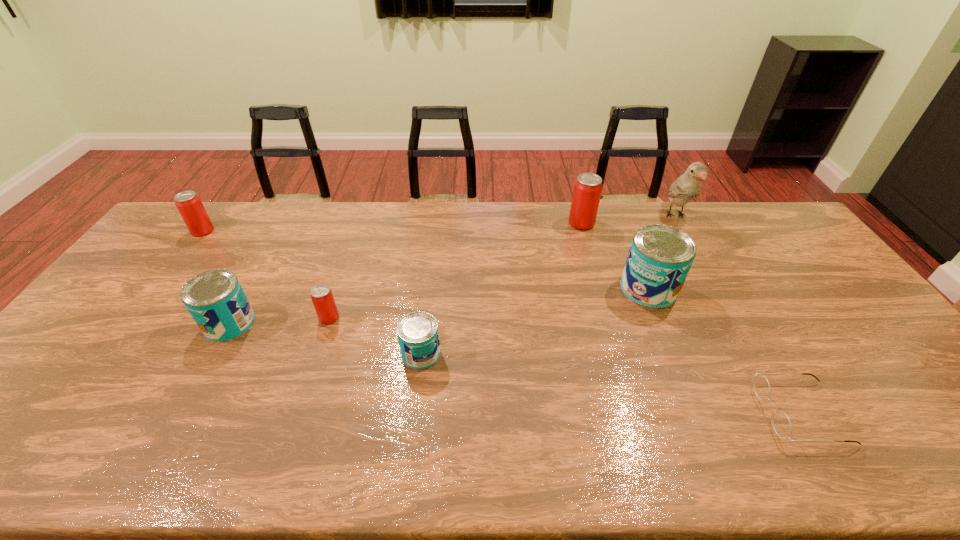
The image size is (960, 540). I want to click on vacant space that's between the shortest object and the leftmost can, so click(x=502, y=322).

Find the location of a particular element. The height and width of the screenshot is (540, 960). vacant area that lies between the leftmost red can and the rightmost red can is located at coordinates (392, 227).

This screenshot has height=540, width=960. I want to click on free space between the fifth object from left to right and the second object from left to right, so click(x=405, y=273).

Where is `the third closest object to the leftmost object`? The width and height of the screenshot is (960, 540). the third closest object to the leftmost object is located at coordinates [418, 335].

At what (x,y) coordinates should I click in order to perform the action: click on object that is the third closest to the rightmost red can. Please return your answer as a coordinate pair (x, y). The width and height of the screenshot is (960, 540). Looking at the image, I should click on (418, 335).

Locate which can is the second closest to the leftmost red can. Please provide its 2D coordinates. Your answer should be formatted as a tuple, i.e. [(x, y)], where the tuple contains the x and y coordinates of a point satisfying the conditions above.

[(321, 295)]

This screenshot has width=960, height=540. In order to click on can object that ranks as the closest to the fifth can from left to right in this screenshot , I will do `click(660, 256)`.

Locate which blue can ranks second in proximity to the rightmost blue can. Please provide its 2D coordinates. Your answer should be formatted as a tuple, i.e. [(x, y)], where the tuple contains the x and y coordinates of a point satisfying the conditions above.

[(215, 299)]

Identify which blue can is the second closest to the leftmost object. Please provide its 2D coordinates. Your answer should be formatted as a tuple, i.e. [(x, y)], where the tuple contains the x and y coordinates of a point satisfying the conditions above.

[(418, 335)]

Identify which red can is located as the third nearest to the nearest object. Please provide its 2D coordinates. Your answer should be formatted as a tuple, i.e. [(x, y)], where the tuple contains the x and y coordinates of a point satisfying the conditions above.

[(188, 203)]